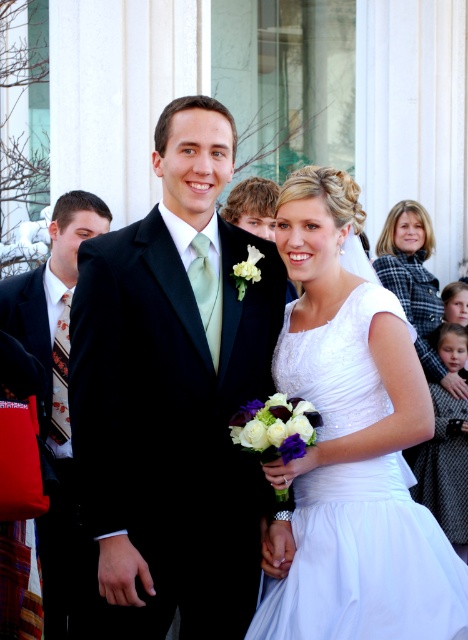
You are a photographer at a wedding. You need to position the matte black suit at left and the white satin dress at right in a way that they are centered in the frame. Given their current positions, which direction should you move each to achieve this?

To center the matte black suit at left and white satin dress at right in the frame, move the matte black suit at left to the right and the white satin dress at right to the left until they are aligned centrally.